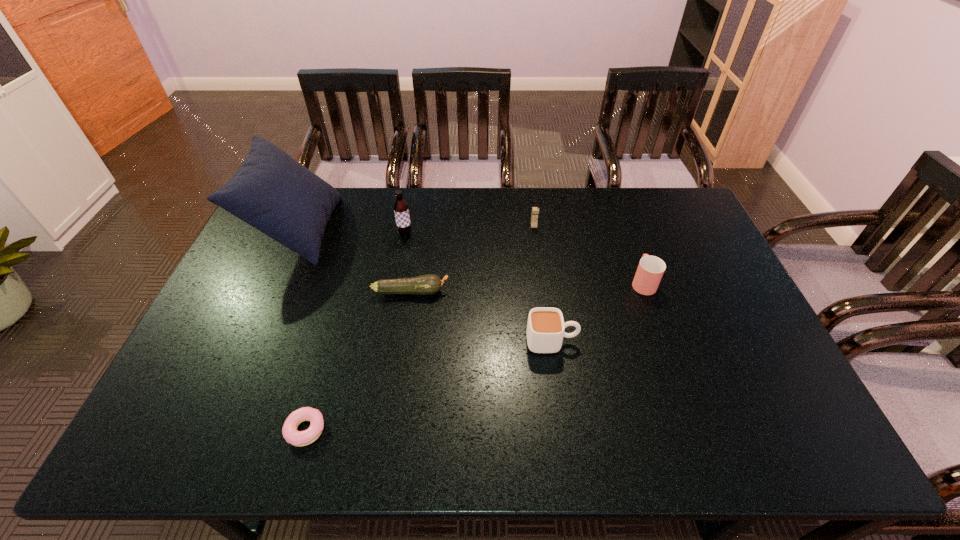
Locate which object ranks in proximity to the second shortest object. Please provide its 2D coordinates. Your answer should be formatted as a tuple, i.e. [(x, y)], where the tuple contains the x and y coordinates of a point satisfying the conditions above.

[(271, 191)]

Locate an element on the screen. object that stands as the second closest to the sixth shortest object is located at coordinates (x=271, y=191).

Locate an element on the screen. This screenshot has width=960, height=540. free space that satisfies the following two spatial constraints: 1. on the front of the cellular telephone, where the keypad is located; 2. on the facing side of the cushion is located at coordinates (535, 230).

Image resolution: width=960 pixels, height=540 pixels. I want to click on vacant area that satisfies the following two spatial constraints: 1. on the front of the third tallest object, where the keypad is located; 2. on the facing side of the leftmost object, so click(535, 230).

This screenshot has width=960, height=540. I want to click on free space that satisfies the following two spatial constraints: 1. on the side of the right cup with the handle; 2. on the facing side of the leftmost object, so click(x=624, y=230).

I want to click on vacant position in the image that satisfies the following two spatial constraints: 1. on the side of the farther cup with the handle; 2. on the facing side of the tallest object, so click(624, 230).

Image resolution: width=960 pixels, height=540 pixels. Find the location of `free region that satisfies the following two spatial constraints: 1. on the back side of the root beer; 2. on the facing side of the tallest object`. free region that satisfies the following two spatial constraints: 1. on the back side of the root beer; 2. on the facing side of the tallest object is located at coordinates (406, 230).

Identify the location of vacant region that satisfies the following two spatial constraints: 1. on the facing side of the tallest object; 2. on the left side of the sixth object from right to left. (207, 430).

At what (x,y) coordinates should I click in order to perform the action: click on free location that satisfies the following two spatial constraints: 1. on the facing side of the doughnut; 2. on the left side of the leftmost object. Please return your answer as a coordinate pair (x, y). Image resolution: width=960 pixels, height=540 pixels. Looking at the image, I should click on (207, 430).